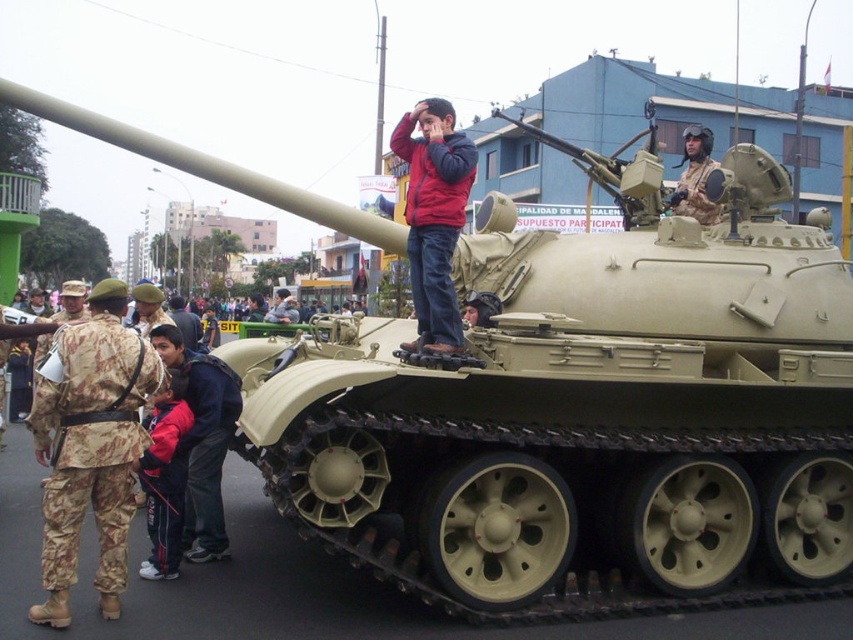
You are a photographer standing at the camera position. You want to take a photo of the camouflage fabric uniform at left and the military tank parked on the street. Can you fit both subjects in the frame if your camera has a 50mm lens? Explain why or why not.

The camouflage fabric uniform at left is 15.79 feet away from the camera. Since the military tank is parked on the street in front of the uniform, it would block the view of the uniform. Therefore, you cannot fit both subjects in the frame with a 50mm lens.

You are standing in front of the military tank and want to take a photo that includes both point (436,204) and point (701,220). Which point should be placed closer to the front of the photo to ensure both are in frame?

Point (436,204) should be placed closer to the front of the photo because it is closer to the camera than point (701,220).